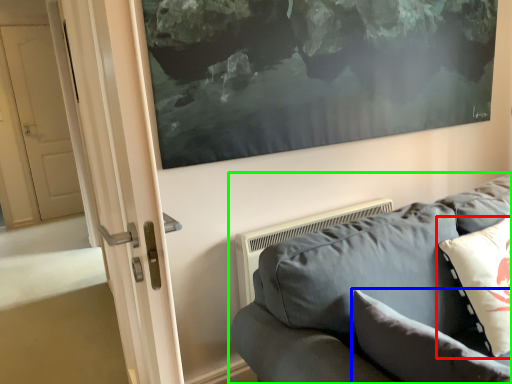
Question: Based on their relative distances, which object is farther from pillow (highlighted by a red box)? Choose from pillow (highlighted by a blue box) and studio couch (highlighted by a green box).

Choices:
 (A) pillow
 (B) studio couch

Answer: (A)